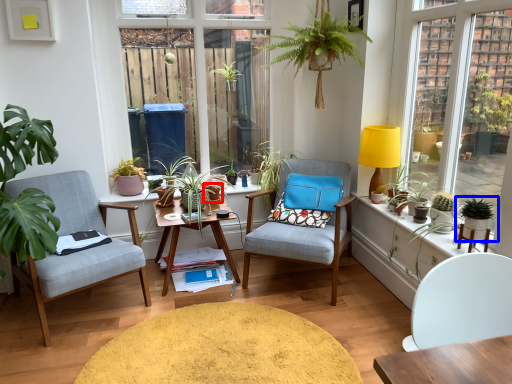
Question: Which object appears farthest to the camera in this image, flowerpot (highlighted by a red box) or houseplant (highlighted by a blue box)?

Choices:
 (A) flowerpot
 (B) houseplant

Answer: (A)